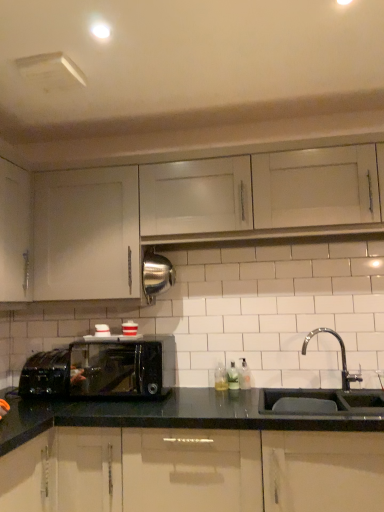
Question: Is white matte cabinet at upper left, which appears as the 2th cabinetry when viewed from the top, to the left or to the right of translucent plastic soap at center, which is the 1th bottle in left-to-right order, in the image?

Choices:
 (A) left
 (B) right

Answer: (A)

Question: From a real-world perspective, relative to translucent plastic soap at center, which is the 1th bottle in left-to-right order, is white matte cabinet at upper left, which appears as the 2th cabinetry when ordered from the bottom, vertically above or below?

Choices:
 (A) above
 (B) below

Answer: (A)

Question: Which of these objects is positioned closest to the clear glass soap dispenser at sink right, which is counted as the third bottle, starting from the left?

Choices:
 (A) translucent plastic soap dispenser at center, the 2th bottle in the left-to-right sequence
 (B) black matte sink at lower right
 (C) glossy black cabinets at lower center, positioned as the 3th cabinetry in top-to-bottom order
 (D) black glossy microwave oven at lower left
 (E) white matte cabinet at upper center, arranged as the 1th cabinetry when viewed from the top

Answer: (A)

Question: Estimate the real-world distances between objects in this image. Which object is farther from the clear glass soap dispenser at sink right, which is counted as the first bottle, starting from the right?

Choices:
 (A) white matte cabinet at upper center, arranged as the 1th cabinetry when viewed from the top
 (B) translucent plastic soap at center, placed as the third bottle when sorted from right to left
 (C) black matte sink at lower right
 (D) black glossy microwave oven at lower left
 (E) white matte cabinet at upper left, which appears as the 2th cabinetry when viewed from the top

Answer: (E)